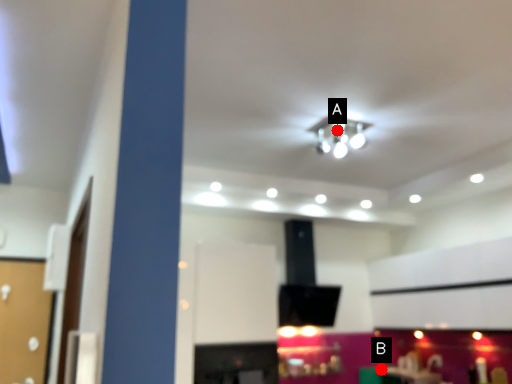
Question: Two points are circled on the image, labeled by A and B beside each circle. Which point is closer to the camera?

Choices:
 (A) A is closer
 (B) B is closer

Answer: (A)